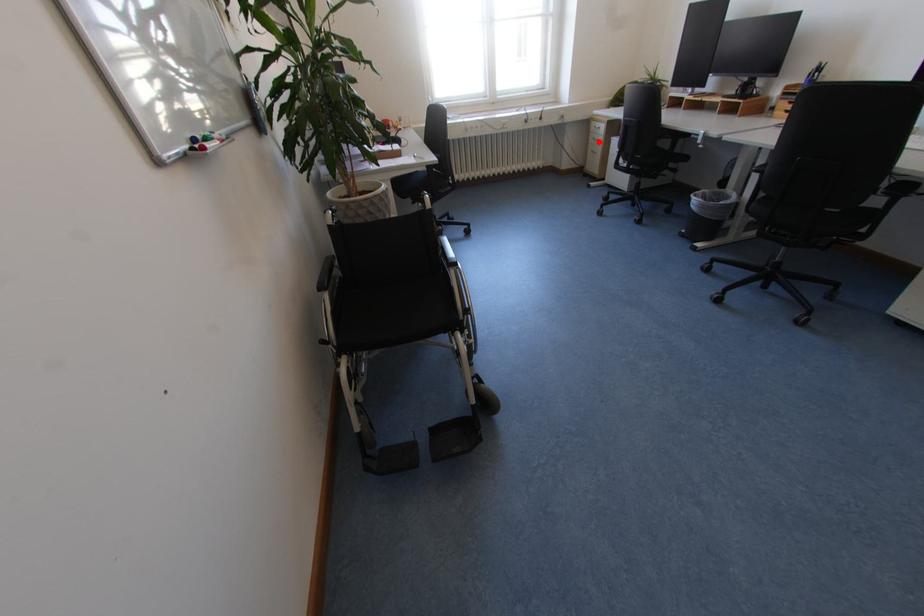
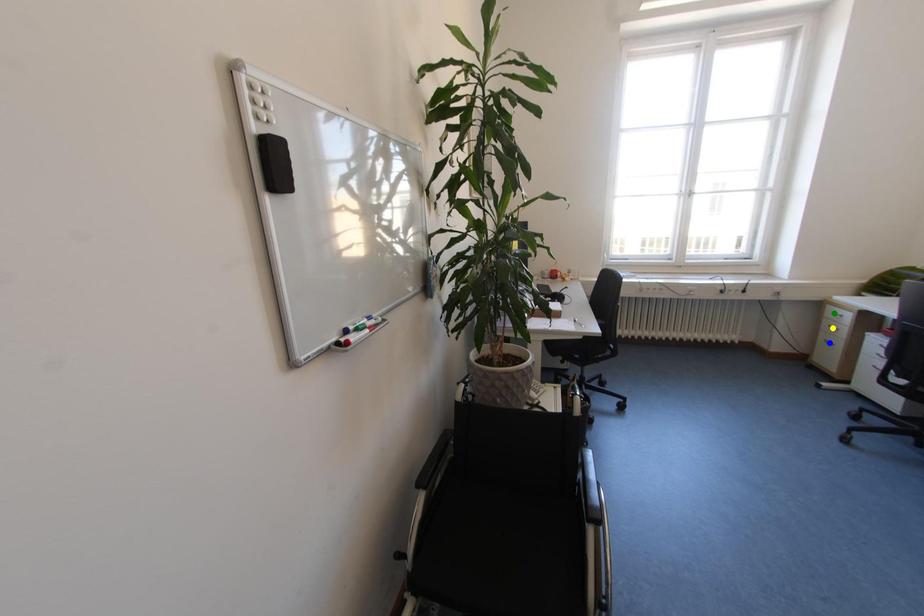
Question: I am providing you with two images of the same scene from different viewpoints. A red point is marked on the first image. You are given multiple points on the second image. Which mark in image 2 goes with the point in image 1?

Choices:
 (A) yellow point
 (B) green point
 (C) blue point

Answer: (A)